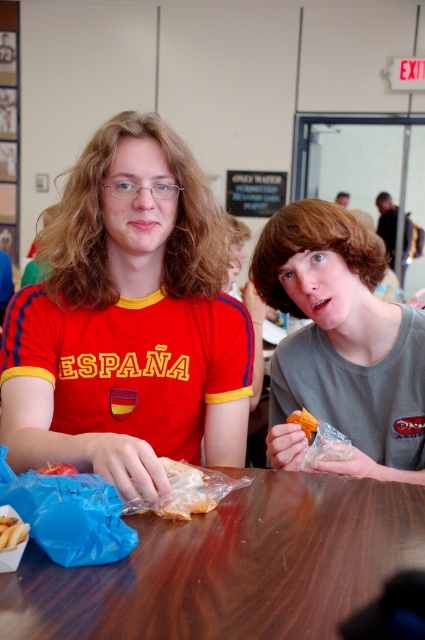
From the picture: You are a photographer setting up for a group photo. You need to ensure that the wooden table at center and the matte gray shirt at center are both visible in the frame. Given their sizes, which object might require you to adjust your camera angle to include it fully?

The matte gray shirt at center requires adjusting the camera angle because it is larger than the wooden table at center, so it might be partially cut off if not framed properly.

You are taking a photo of the two people at the table. Which of the two points, point (x=193, y=582) or point (x=272, y=253), will appear larger in your photo?

Point (x=193, y=582) is closer to the camera than point (x=272, y=253), so it will appear larger in the photo.

You are a delivery robot with a 30 cm wide package. You need to place it on the wooden table at center without touching the matte gray shirt at center. Is there enough space?

The wooden table at center is 29.05 centimeters from matte gray shirt at center. Since the package is 30 cm wide, placing it would require at least 30 cm of space, but there is only 29.05 cm available. Therefore, the package cannot be placed without touching the matte gray shirt at center.